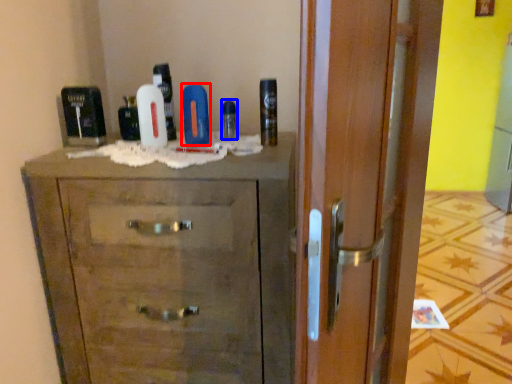
Question: Among these objects, which one is nearest to the camera, toiletry (highlighted by a red box) or mouthwash (highlighted by a blue box)?

Choices:
 (A) toiletry
 (B) mouthwash

Answer: (A)